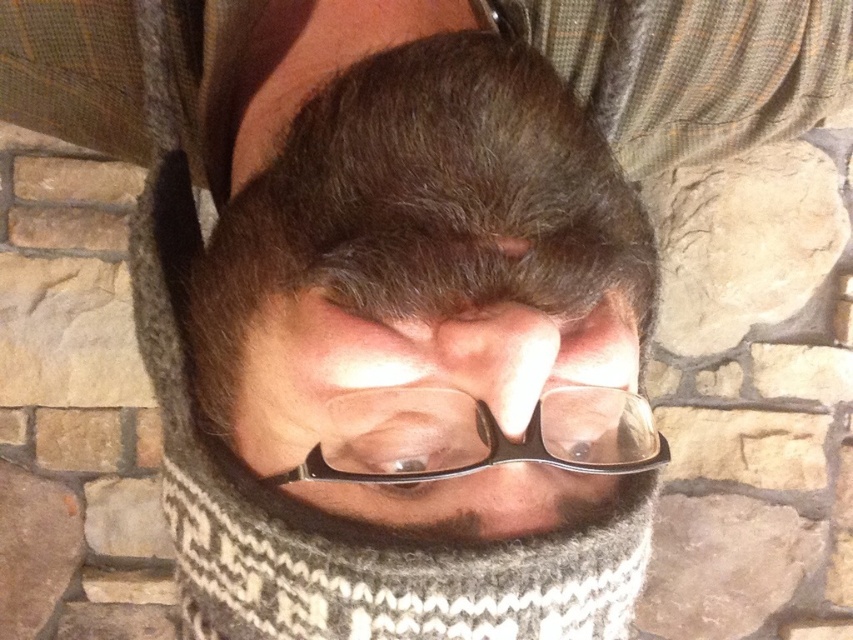
You are a photographer adjusting the focus on your camera. You want to ensure that the matte black glasses at center are in sharp focus. Given that the camera can only focus on objects within a 14 inch range from its current position, will the glasses be in focus?

The matte black glasses at center is 14.58 inches from the camera, which is slightly beyond the 14 inch focus range. Therefore, the glasses will not be in focus.

You are a photographer trying to capture a closeup shot of someone wearing glasses. You notice both the matte black glasses at center and the transparent plastic glasses at center. Which pair of glasses is currently covering the other?

The matte black glasses at center is positioned over transparent plastic glasses at center, so the matte black glasses at center is covering the transparent plastic glasses at center.

You are a photographer trying to capture a closeup portrait of a person wearing two pairs of glasses. You notice the matte black glasses at center and transparent plastic glasses at center. Which pair of glasses would you need to adjust the camera focus on first if they are at different distances from the lens?

The matte black glasses at center is larger in width than transparent plastic glasses at center, so the photographer should focus on the matte black glasses at center first because larger objects may require more precise focus adjustment.